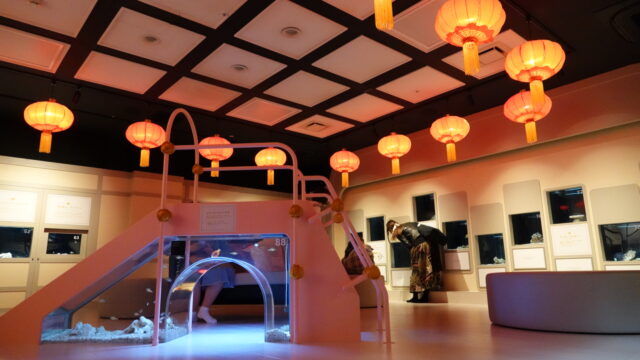
Identify the location of wall. Image resolution: width=640 pixels, height=360 pixels. (589, 144).